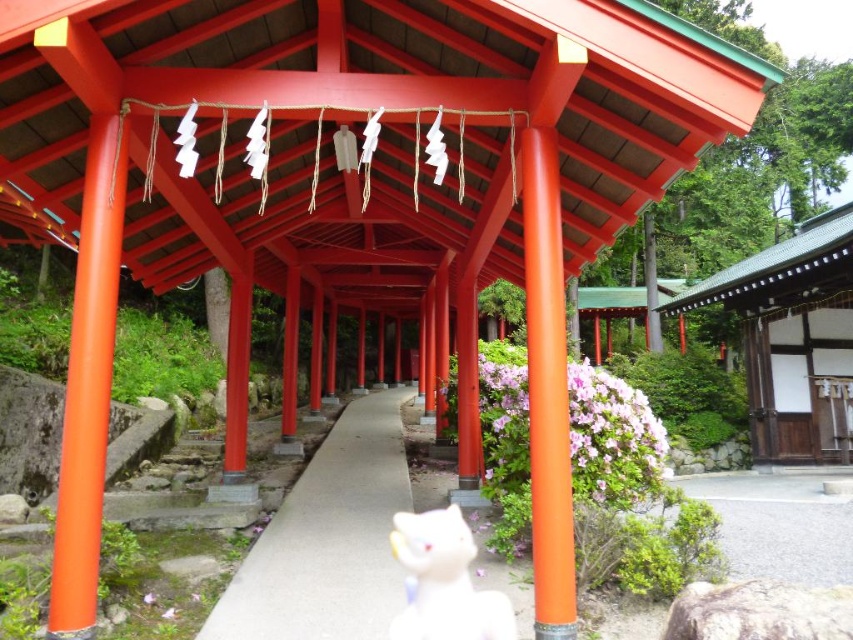
You are standing in front of the torii gate and notice a concrete at center and a white glossy cat at center. Which object is directly below the other?

The concrete at center is positioned under the white glossy cat at center, so the white glossy cat at center is directly above the concrete at center.

You are standing in front of the torii gate and see the concrete at center and the white glossy cat at center. Which object is positioned to the left side?

The concrete at center is to the left of the white glossy cat at center.

You are a visitor at the Shinto shrine and want to take a photo of the torii gate. You notice the concrete at center and the green shingled roof at upper right in your viewfinder. Which object takes up more area in the photo?

The green shingled roof at upper right takes up more area in the photo than the concrete at center because the concrete at center occupies less space than green shingled roof at upper right.